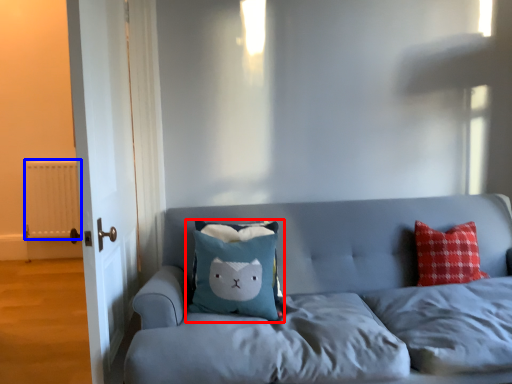
Question: Among these objects, which one is nearest to the camera, pillow (highlighted by a red box) or radiator (highlighted by a blue box)?

Choices:
 (A) pillow
 (B) radiator

Answer: (A)